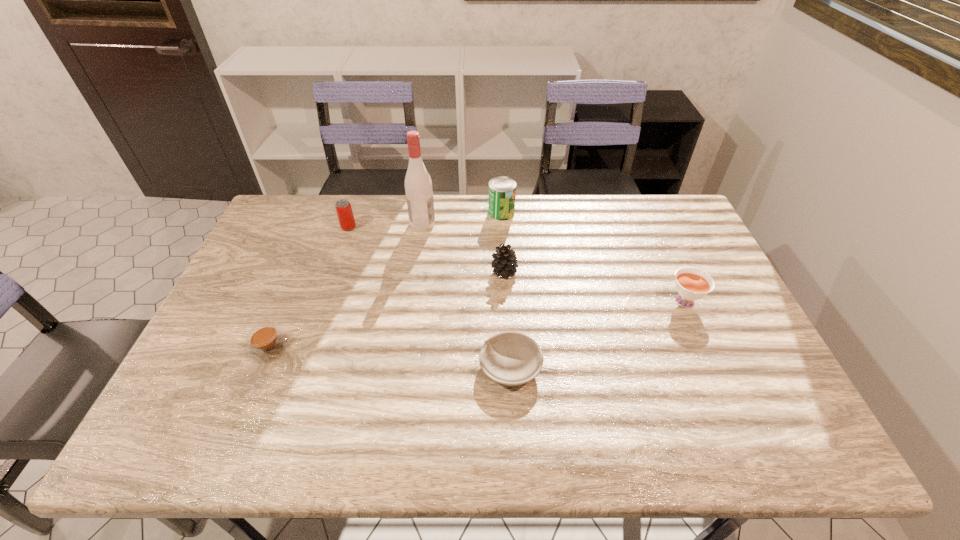
What are the coordinates of `vacant space located on the label of the tallest object` in the screenshot? It's located at (491, 223).

The width and height of the screenshot is (960, 540). Find the location of `vacant region located on the right of the can`. vacant region located on the right of the can is located at coordinates (603, 212).

In order to click on vacant space located 0.190m on the front of the pinecone in this screenshot , I will do `click(508, 333)`.

The height and width of the screenshot is (540, 960). Identify the location of vacant position located 0.070m on the front of the beer can. (343, 246).

Locate an element on the screen. Image resolution: width=960 pixels, height=540 pixels. free location located on the side of the fifth farthest object with the handle is located at coordinates (658, 239).

Where is `free space located on the side of the fifth farthest object with the handle`? The image size is (960, 540). free space located on the side of the fifth farthest object with the handle is located at coordinates (652, 227).

Identify the location of free location located 0.310m on the side of the fifth farthest object with the handle. tap(649, 220).

At what (x,y) coordinates should I click in order to perform the action: click on vacant space located 0.110m on the back of the sixth tallest object. Please return your answer as a coordinate pair (x, y). Looking at the image, I should click on (288, 300).

At what (x,y) coordinates should I click in order to perform the action: click on vacant space located on the left of the shortest object. Please return your answer as a coordinate pair (x, y). The image size is (960, 540). Looking at the image, I should click on (379, 368).

Image resolution: width=960 pixels, height=540 pixels. In order to click on alcohol present at the far edge in this screenshot , I will do point(418,186).